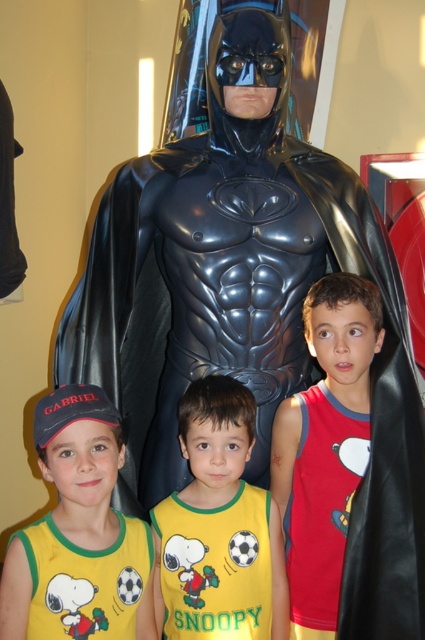
You are a photographer trying to capture a photo of the Batman figure and the children. You need to ensure that both the yellow jersey at center and the red cotton tank top at center are clearly visible in the frame. Based on their positions, which one should you focus on first to ensure it doesn t get cut off?

The yellow jersey at center is below the red cotton tank top at center, so you should focus on the red cotton tank top at center first to ensure it doesn t get cut off since it is positioned higher up in the frame.